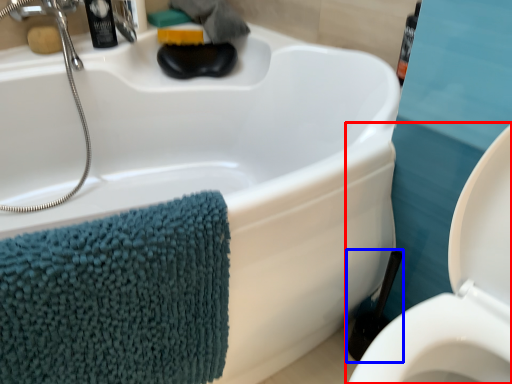
Question: Which of the following is the farthest to the observer, toilet (highlighted by a red box) or brush (highlighted by a blue box)?

Choices:
 (A) toilet
 (B) brush

Answer: (B)